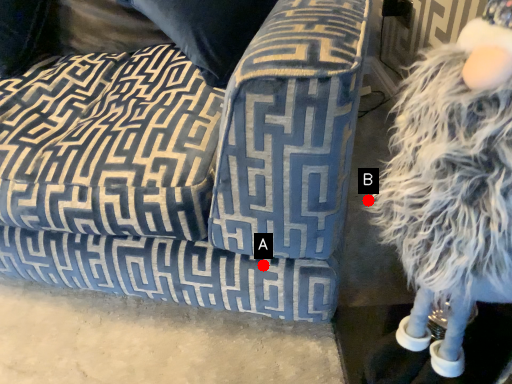
Question: Two points are circled on the image, labeled by A and B beside each circle. Which point is further to the camera?

Choices:
 (A) A is further
 (B) B is further

Answer: (A)